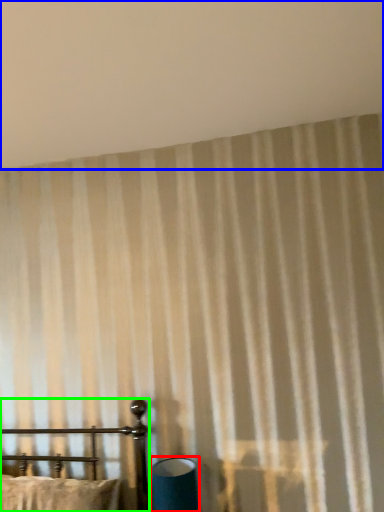
Question: Which object is the farthest from table lamp (highlighted by a red box)? Choose among these: backdrop (highlighted by a blue box) or furniture (highlighted by a green box).

Choices:
 (A) backdrop
 (B) furniture

Answer: (A)